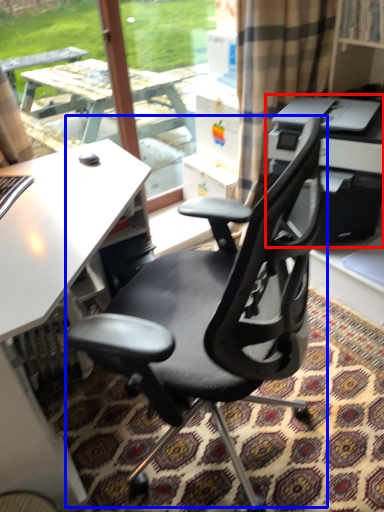
Question: Among these objects, which one is nearest to the camera, printer (highlighted by a red box) or chair (highlighted by a blue box)?

Choices:
 (A) printer
 (B) chair

Answer: (B)